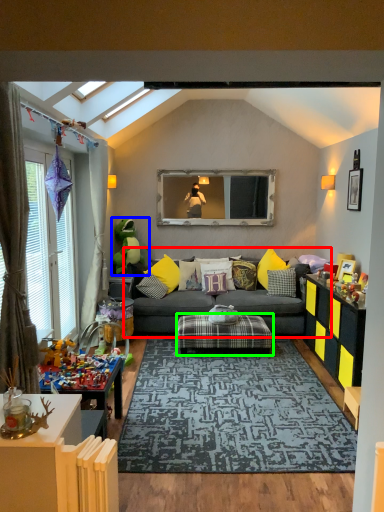
Question: Estimate the real-world distances between objects in this image. Which object is farther from studio couch (highlighted by a red box), toy (highlighted by a blue box) or table (highlighted by a green box)?

Choices:
 (A) toy
 (B) table

Answer: (A)